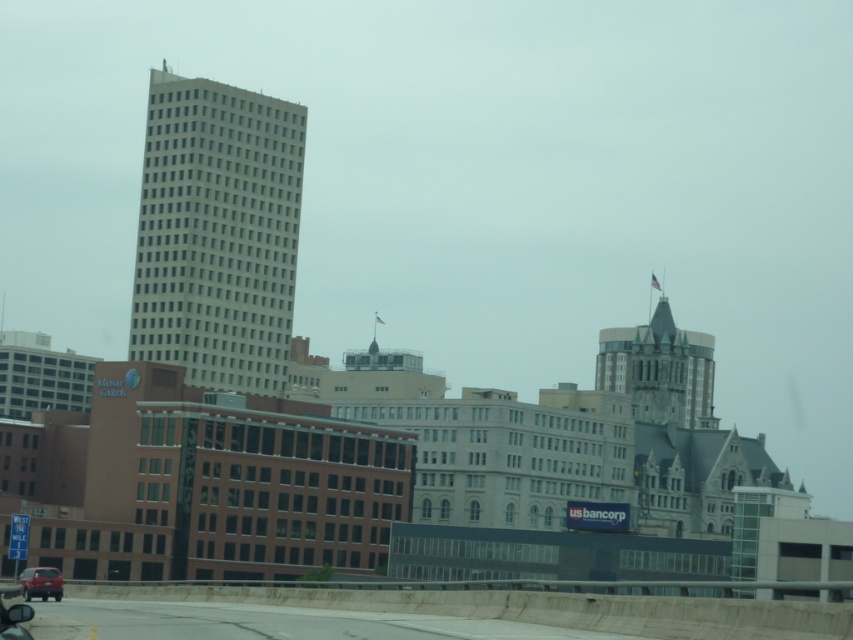
You are a delivery driver who needs to navigate through the city. You see the green copper spire at upper right and the matte red car at lower left in your view. Which object is positioned to the right side of the other?

The green copper spire at upper right is to the right of the matte red car at lower left.

In the scene shown: You are a photographer trying to capture both the green copper spire at upper right and the matte red car at lower left in a single shot. Based on their sizes, which object should you focus on first to ensure both fit in the frame?

The green copper spire at upper right is wider than the matte red car at lower left, so you should focus on the green copper spire at upper right first to ensure both fit in the frame.

You are a pedestrian standing at the crosswalk and want to cross the street. You see the white smooth building at center and the matte red car at lower left. Which object is closer to you?

The matte red car at lower left is behind the white smooth building at center, so the white smooth building at center is closer to you.